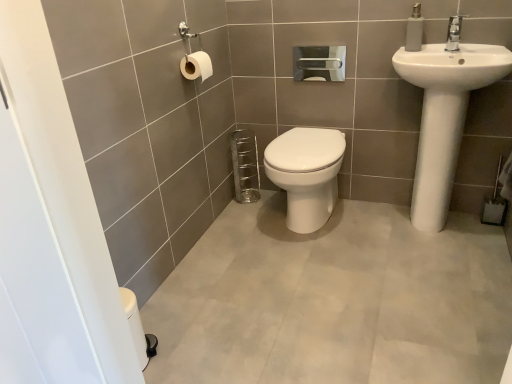
At what (x,y) coordinates should I click in order to perform the action: click on vacant space situated above white glossy toilet at center (from a real-world perspective). Please return your answer as a coordinate pair (x, y). Looking at the image, I should click on (298, 134).